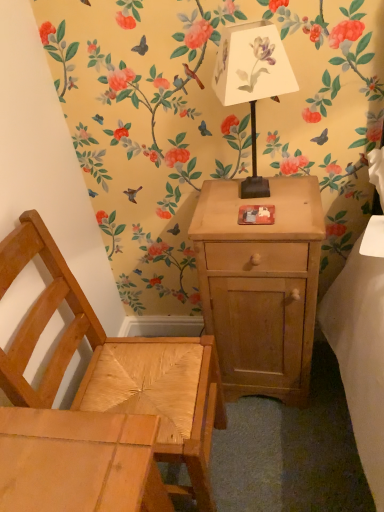
At what (x,y) coordinates should I click in order to perform the action: click on vacant space in front of white paper lampshade at upper center. Please return your answer as a coordinate pair (x, y). The image size is (384, 512). Looking at the image, I should click on click(x=269, y=225).